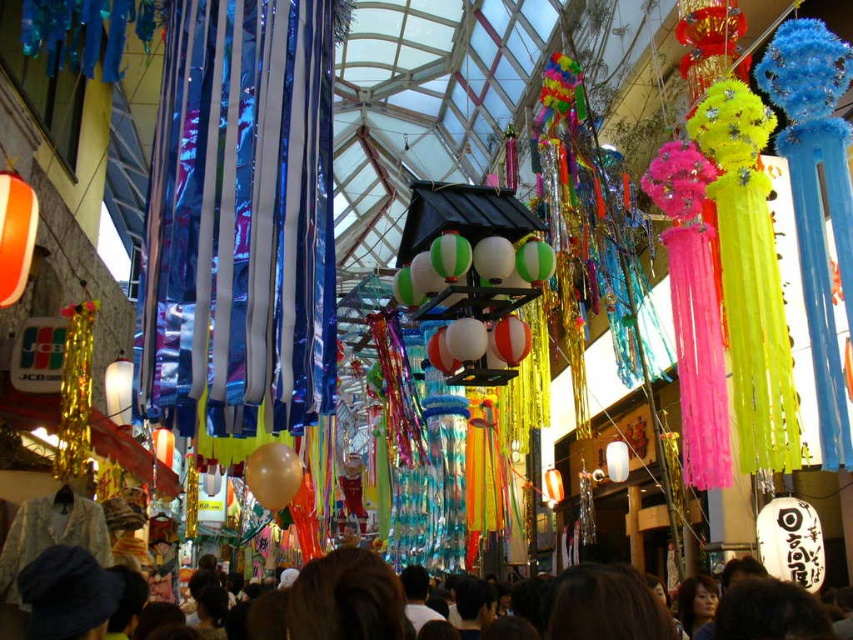
You are standing in the shopping arcade and want to move from the entrance to the exit. There are two points marked in the scene, point 1 at coordinates point [83,556] and point 2 at coordinates point [517,285]. Which point should you walk towards first if you want to take the shortest path to the exit?

Point 1 at coordinates point [83,556] is in front of point [517,285], so you should walk towards point 1 first to take the shortest path to the exit.

Consider the image. You are a party planner arranging decorations. You have two balloons at the center of the scene, the green and white striped balloons at center and the translucent gold balloon at center. Which one do you think has a larger diameter?

The green and white striped balloons at center might be wider than translucent gold balloon at center, so they likely have a larger diameter.